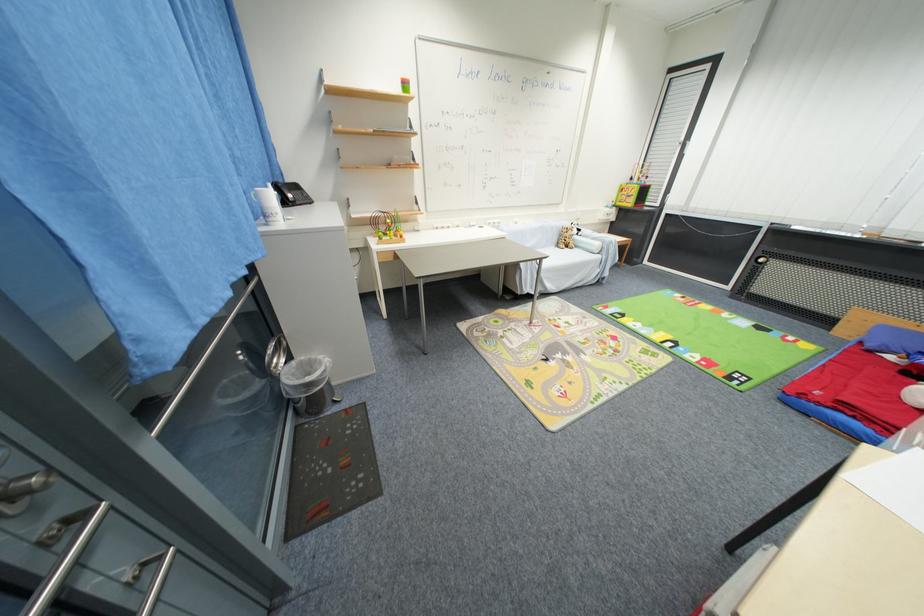
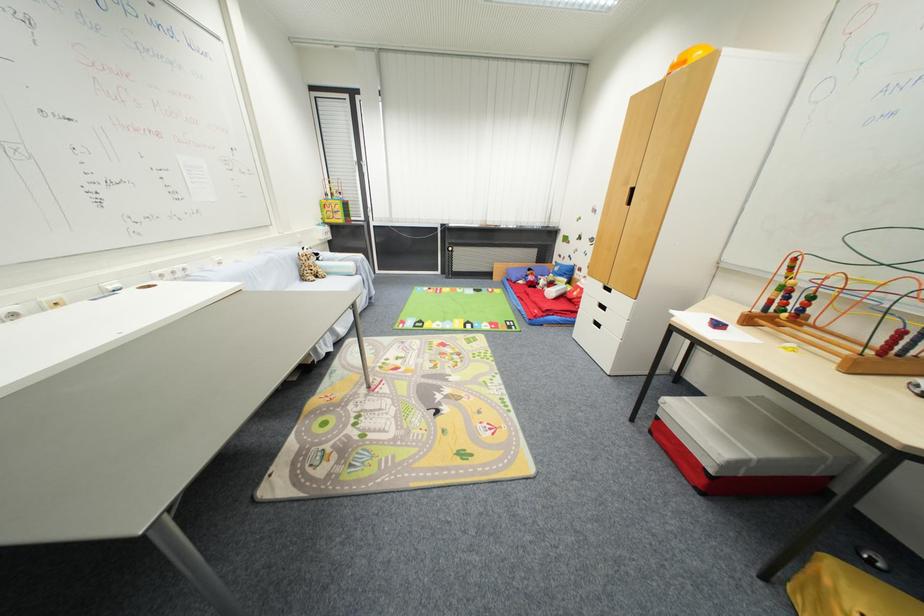
Find the pixel in the second image that matches point 602,326 in the first image.

(423, 342)